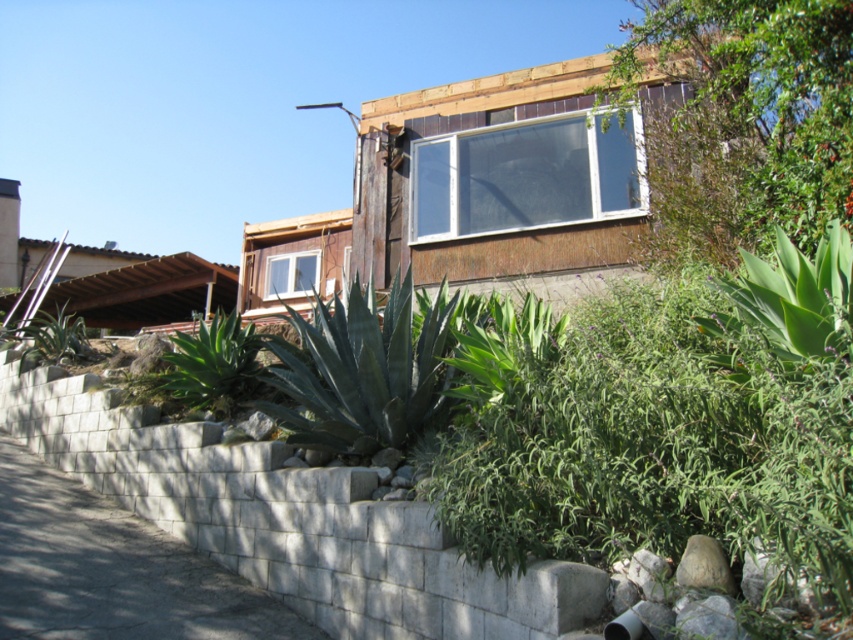
Question: Which object is farther from the camera taking this photo?

Choices:
 (A) dark green leafy plant at center
 (B) green leafy plant at lower left
 (C) green leafy plant at center

Answer: (B)

Question: Which point is farther to the camera?

Choices:
 (A) dark green leafy plant at center
 (B) green leafy plant at center

Answer: (B)

Question: Based on their relative distances, which object is farther from the green leafy plant at center?

Choices:
 (A) green leafy plant at lower left
 (B) dark green leafy plant at center

Answer: (A)

Question: Can you confirm if green leafy plant at center is smaller than green leafy plant at lower left?

Choices:
 (A) no
 (B) yes

Answer: (B)

Question: Is dark green leafy plant at center positioned before green leafy plant at lower left?

Choices:
 (A) no
 (B) yes

Answer: (B)

Question: Does green leafy plant at center have a lesser width compared to green leafy plant at lower left?

Choices:
 (A) no
 (B) yes

Answer: (B)